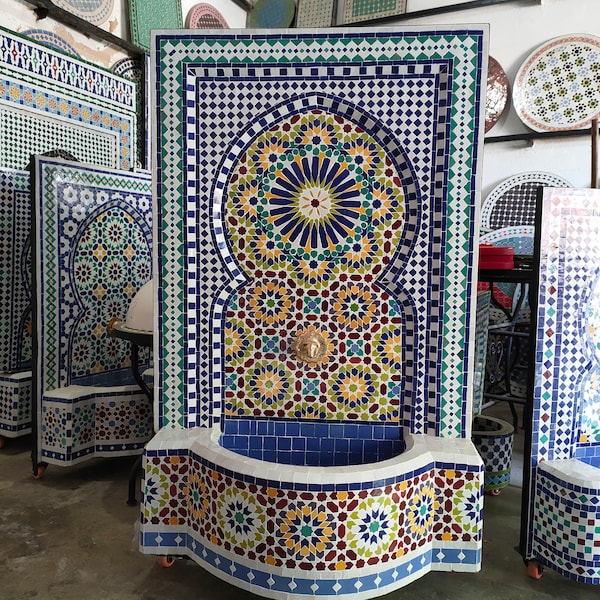
You are a GUI agent. You are given a task and a screenshot of the screen. Output one action in this format:
    pyautogui.click(x=<x>, y=<y>)
    Task: Click on the white tiles surface
    
    Given the screenshot: What is the action you would take?
    pyautogui.click(x=300, y=471), pyautogui.click(x=183, y=439), pyautogui.click(x=446, y=447)